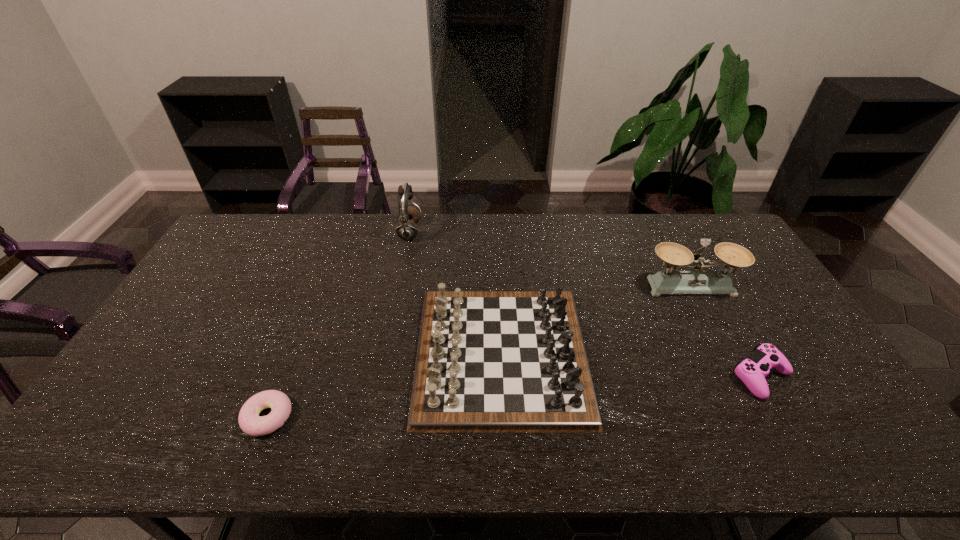
This screenshot has width=960, height=540. I want to click on vacant space that's between the third object from left to right and the control, so pos(631,365).

Point out which object is positioned as the third nearest to the tallest object. Please provide its 2D coordinates. Your answer should be formatted as a tuple, i.e. [(x, y)], where the tuple contains the x and y coordinates of a point satisfying the conditions above.

[(699, 281)]

Locate an element on the screen. The image size is (960, 540). object that stands as the closest to the tallest object is located at coordinates (487, 361).

The image size is (960, 540). What are the coordinates of `free space that satisfies the following two spatial constraints: 1. on the ear pads of the control; 2. on the left side of the tallest object` in the screenshot? It's located at (380, 376).

Identify the location of free location that satisfies the following two spatial constraints: 1. on the back side of the control; 2. on the left side of the doughnut. This screenshot has width=960, height=540. (284, 376).

This screenshot has width=960, height=540. I want to click on free spot that satisfies the following two spatial constraints: 1. on the ear pads of the fourth tallest object; 2. on the left side of the farthest object, so click(x=380, y=376).

Locate an element on the screen. The width and height of the screenshot is (960, 540). vacant space that satisfies the following two spatial constraints: 1. from the player's perspective of the third tallest object; 2. on the back side of the control is located at coordinates (502, 376).

At what (x,y) coordinates should I click in order to perform the action: click on free space that satisfies the following two spatial constraints: 1. from the player's perspective of the third object from left to right; 2. on the front side of the leftmost object. Please return your answer as a coordinate pair (x, y). This screenshot has height=540, width=960. Looking at the image, I should click on (504, 417).